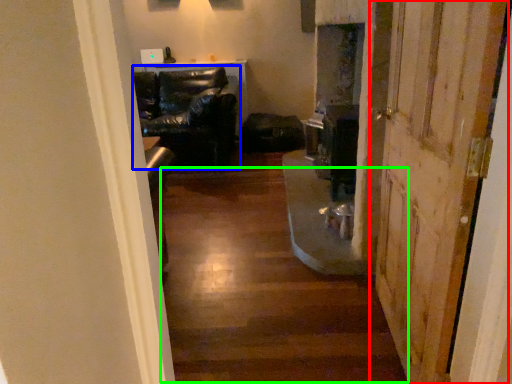
Question: Which is farther away from door (highlighted by a red box)? chair (highlighted by a blue box) or stairwell (highlighted by a green box)?

Choices:
 (A) chair
 (B) stairwell

Answer: (A)